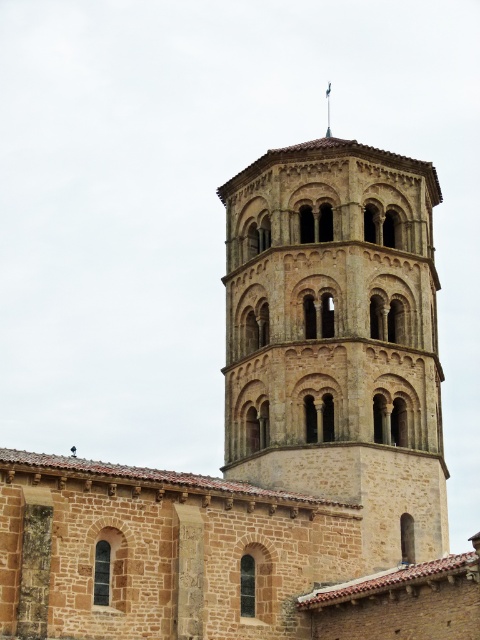
You are standing at the center of the image. Which direction should you move to reach the brown stone bell tower at center?

The brown stone bell tower at center is already at the center of the image, so you don not need to move in any direction to reach it.

You are standing in front of the historic stone tower described in the scene. There is a specific point marked at coordinates point [337,339]. Which object in the scene does this point belong to?

The point [337,339] is on the brown stone bell tower at center.

You are standing in front of the historic stone tower and want to take a photo. You notice two points marked on the tower at coordinates point (x=398, y=170) and point (x=327, y=88). Which point is closer to your camera position?

Point (x=398, y=170) is closer to the camera than point (x=327, y=88).